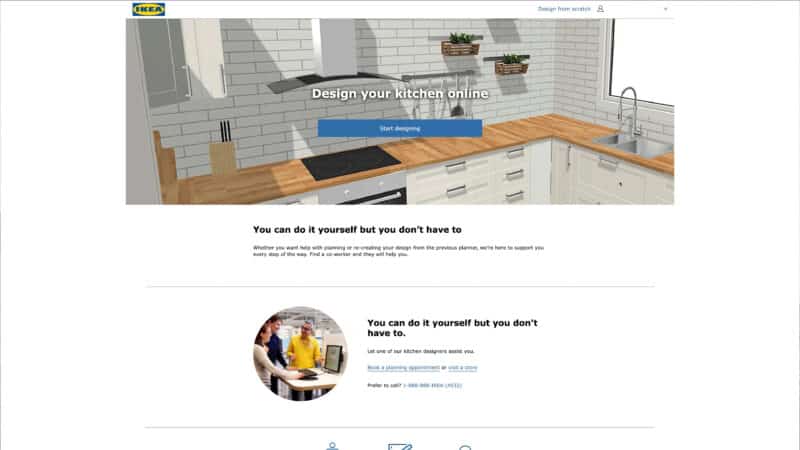
Image resolution: width=800 pixels, height=450 pixels. What are the coordinates of `knives` in the screenshot? It's located at (224, 134), (228, 154).